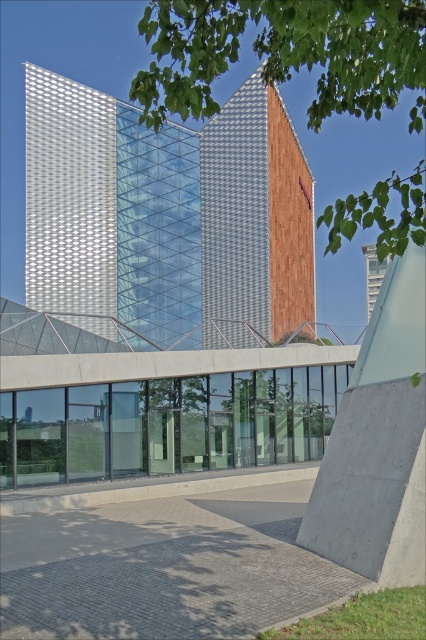
Can you confirm if metallic grid tower at center is positioned to the right of white glass tower at upper center?

No, metallic grid tower at center is not to the right of white glass tower at upper center.

Is metallic grid tower at center taller than white glass tower at upper center?

Correct, metallic grid tower at center is much taller as white glass tower at upper center.

You are a GUI agent. You are given a task and a screenshot of the screen. Output one action in this format:
    pyautogui.click(x=<x>, y=<y>)
    Task: Click on the metallic grid tower at center
    Image resolution: width=426 pixels, height=640 pixels.
    Given the screenshot: What is the action you would take?
    pyautogui.click(x=166, y=212)

Between point (238, 157) and point (339, 109), which one is positioned in front?

Positioned in front is point (339, 109).

Where is `metallic grid tower at center`? The height and width of the screenshot is (640, 426). metallic grid tower at center is located at coordinates (166, 212).

What do you see at coordinates (255, 220) in the screenshot? Image resolution: width=426 pixels, height=640 pixels. I see `wooden panel at center` at bounding box center [255, 220].

This screenshot has width=426, height=640. What do you see at coordinates (255, 220) in the screenshot?
I see `wooden panel at center` at bounding box center [255, 220].

Locate an element on the screen. The height and width of the screenshot is (640, 426). wooden panel at center is located at coordinates click(255, 220).